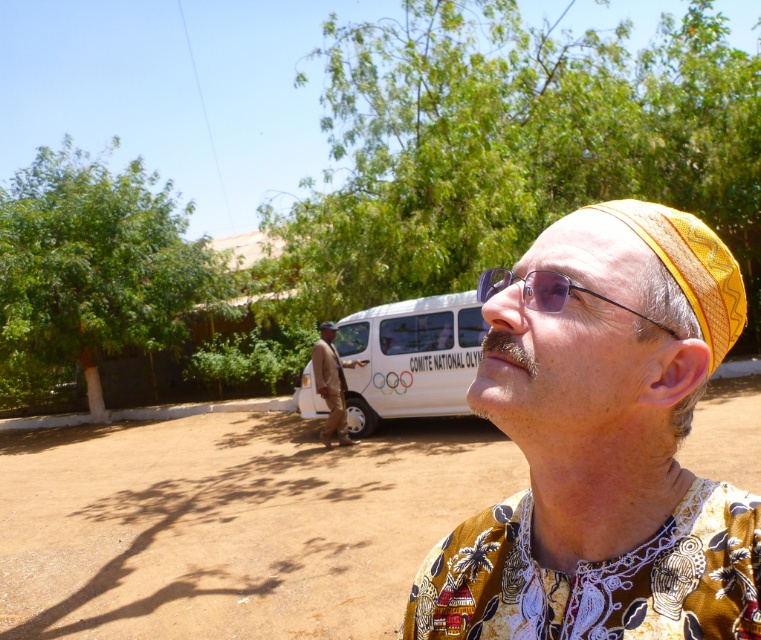
Is point (215, 477) behind point (540, 300)?

Yes, point (215, 477) is behind point (540, 300).

Who is positioned more to the left, brown sandy dirt at lower center or transparent plastic glasses at center?

Positioned to the left is transparent plastic glasses at center.

Who is more forward, (72, 618) or (527, 305)?

Point (527, 305) is more forward.

This screenshot has width=761, height=640. Find the location of `brown sandy dirt at lower center`. brown sandy dirt at lower center is located at coordinates (231, 524).

Which is below, yellow printed fabric headband at center or transparent plastic glasses at center?

transparent plastic glasses at center is below.

Can you confirm if yellow printed fabric headband at center is positioned to the right of transparent plastic glasses at center?

Correct, you'll find yellow printed fabric headband at center to the right of transparent plastic glasses at center.

This screenshot has height=640, width=761. Describe the element at coordinates (632, 260) in the screenshot. I see `yellow printed fabric headband at center` at that location.

This screenshot has width=761, height=640. I want to click on yellow printed fabric headband at center, so click(x=632, y=260).

Is point (118, 273) behind point (524, 275)?

Yes, point (118, 273) is behind point (524, 275).

What do you see at coordinates (91, 269) in the screenshot? I see `green leafy tree at upper left` at bounding box center [91, 269].

Is point (196, 253) positioned after point (568, 282)?

Yes.

Identify the location of green leafy tree at upper left. (91, 269).